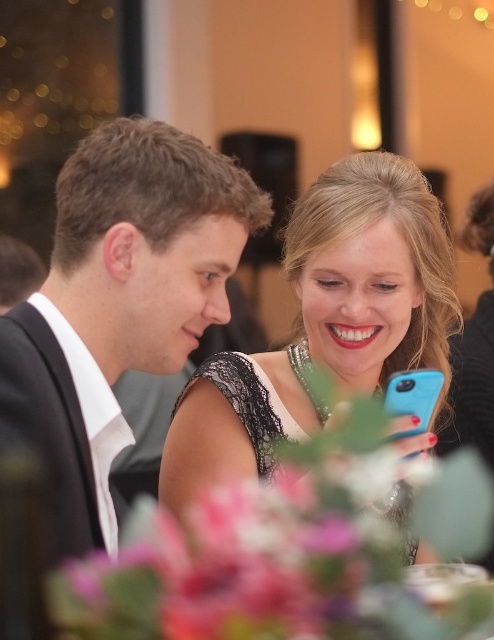
Who is shorter, black satin suit at left or matte black dress at center?

black satin suit at left is shorter.

Is black satin suit at left in front of matte black dress at center?

Yes.

The height and width of the screenshot is (640, 494). What do you see at coordinates (118, 305) in the screenshot?
I see `black satin suit at left` at bounding box center [118, 305].

This screenshot has width=494, height=640. I want to click on black satin suit at left, so click(118, 305).